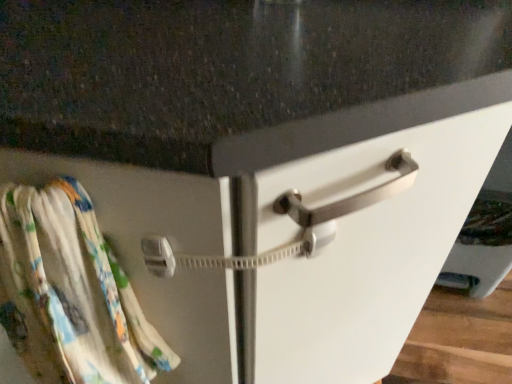
Where is `printed cotton beach towel at left`? The height and width of the screenshot is (384, 512). printed cotton beach towel at left is located at coordinates (70, 293).

Describe the element at coordinates (70, 293) in the screenshot. I see `printed cotton beach towel at left` at that location.

In order to click on printed cotton beach towel at left in this screenshot , I will do `click(70, 293)`.